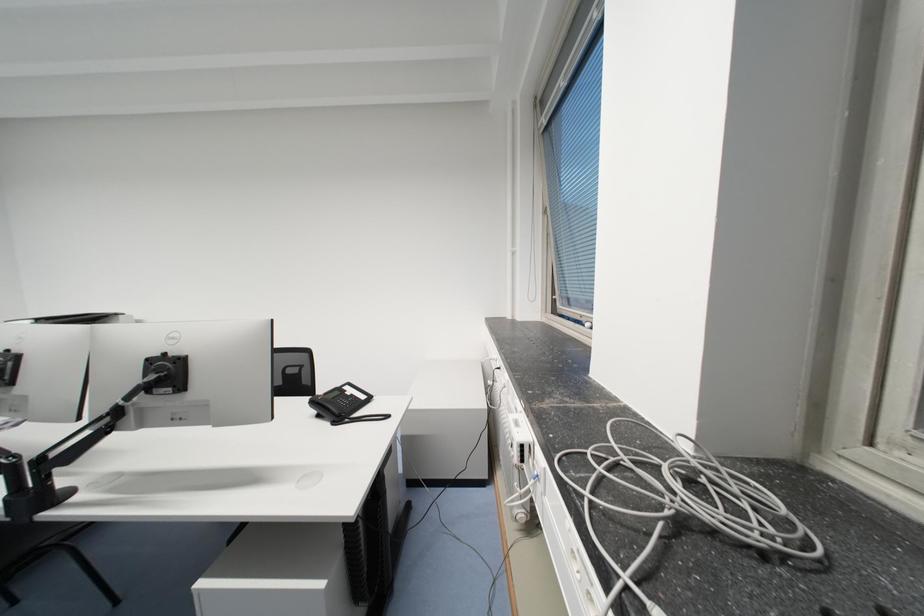
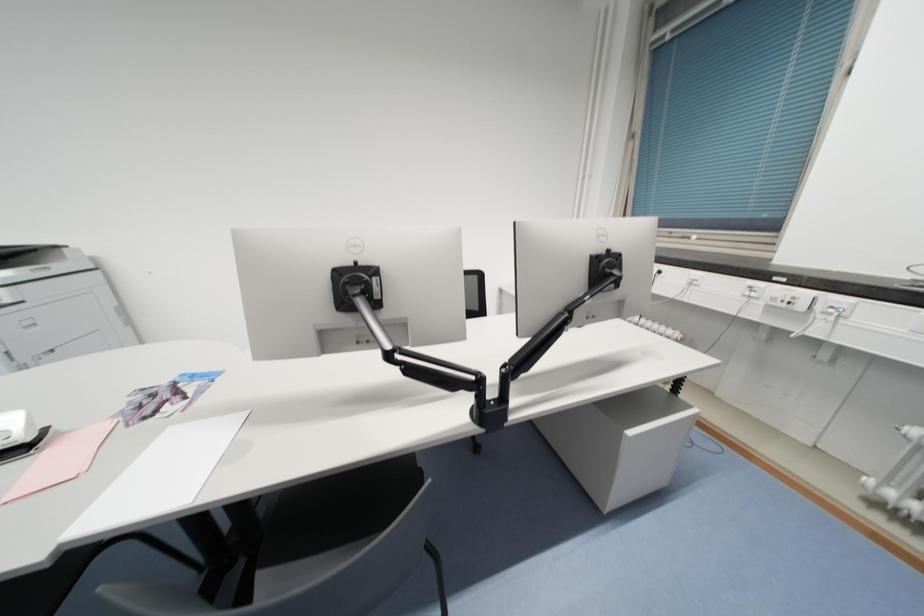
Question: The images are taken continuously from a first-person perspective. In which direction are you moving?

Choices:
 (A) Left
 (B) Right
 (C) Forward
 (D) Backward

Answer: (A)